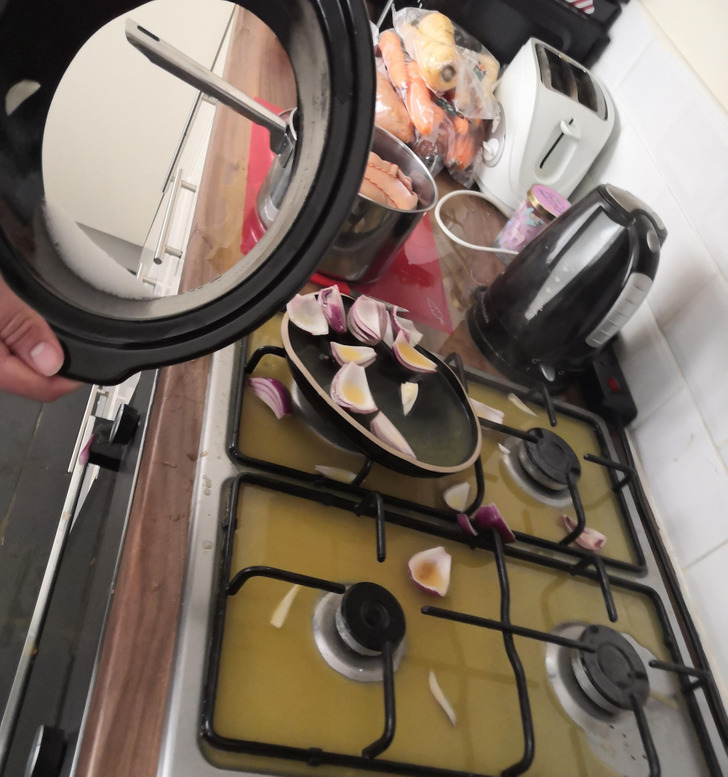
You are a GUI agent. You are given a task and a screenshot of the screen. Output one action in this format:
    pyautogui.click(x=<x>, y=<y>)
    Task: Click on the white electrical cord
    The width and height of the screenshot is (728, 777).
    Given the screenshot: What is the action you would take?
    pyautogui.click(x=451, y=237)